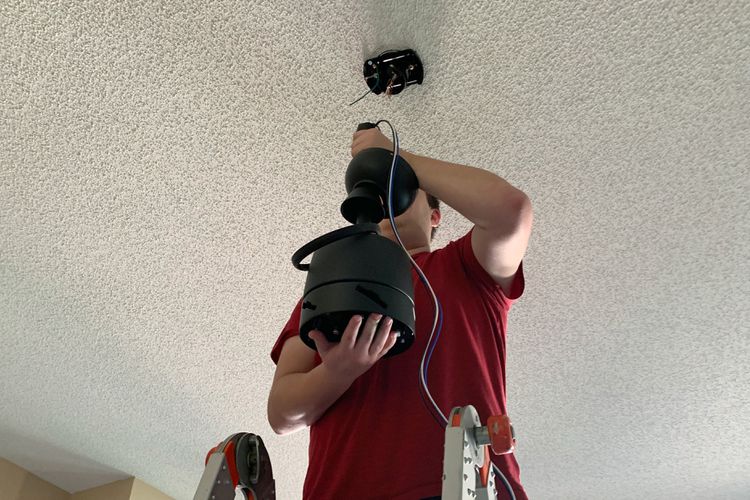
The width and height of the screenshot is (750, 500). What are the coordinates of `ceiling` in the screenshot? It's located at (512, 83).